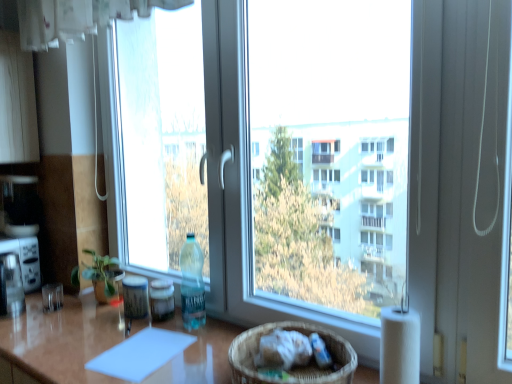
At what (x,y) coordinates should I click in order to perform the action: click on shiny brown table at center. Please return your answer as a coordinate pair (x, y). The image size is (512, 384). Looking at the image, I should click on (58, 341).

What is the approximate height of white paper at right?

It is 24.24 centimeters.

Image resolution: width=512 pixels, height=384 pixels. Describe the element at coordinates (399, 346) in the screenshot. I see `white paper at right` at that location.

What are the coordinates of `white plastic toaster at left` in the screenshot? It's located at (25, 259).

Locate an element on the screen. translucent plastic bottle at center is located at coordinates (162, 299).

Measure the distance between green matte plant at left and camera.

The depth of green matte plant at left is 5.52 feet.

Where is `transparent glass window at center`? Image resolution: width=512 pixels, height=384 pixels. transparent glass window at center is located at coordinates (289, 143).

Is shiny brown table at center positioned before green matte plant at left?

Yes, it is.

The height and width of the screenshot is (384, 512). What are the coordinates of `table below the green matte plant at left (from the image's perspective)` in the screenshot? It's located at (58, 341).

From the image's perspective, which object appears higher, shiny brown table at center or green matte plant at left?

green matte plant at left.

Can you confirm if shiny brown table at center is smaller than green matte plant at left?

No, shiny brown table at center is not smaller than green matte plant at left.

The image size is (512, 384). I want to click on basket located underneath the white plastic toaster at left (from a real-world perspective), so click(x=294, y=366).

Is woven brown basket at lower center not close to white plastic toaster at left?

Yes, woven brown basket at lower center and white plastic toaster at left are located far from each other.

Is woven brown basket at lower center aimed at white plastic toaster at left?

No, woven brown basket at lower center is not aimed at white plastic toaster at left.

Looking at this image, which point is more forward, (x=275, y=325) or (x=26, y=248)?

The point (x=275, y=325) is closer to the camera.

Are green matte plant at left and transparent glass window at center located far from each other?

Yes, green matte plant at left and transparent glass window at center are quite far apart.

Between green matte plant at left and transparent glass window at center, which one has smaller size?

With smaller size is green matte plant at left.

Based on their positions, is green matte plant at left located to the left or right of transparent glass window at center?

Based on their positions, green matte plant at left is located to the left of transparent glass window at center.

Does point (112, 282) lie in front of point (357, 298)?

No, it is not.

Considering the relative sizes of woven brown basket at lower center and translucent plastic bottle at center in the image provided, is woven brown basket at lower center wider than translucent plastic bottle at center?

Indeed, woven brown basket at lower center has a greater width compared to translucent plastic bottle at center.

Is woven brown basket at lower center taller than translucent plastic bottle at center?

In fact, woven brown basket at lower center may be shorter than translucent plastic bottle at center.

In the image, is woven brown basket at lower center positioned in front of or behind translucent plastic bottle at center?

Clearly, woven brown basket at lower center is in front of translucent plastic bottle at center.

Is transparent glass window at center far from woven brown basket at lower center?

transparent glass window at center is positioned a significant distance from woven brown basket at lower center.

Is transparent glass window at center to the right of woven brown basket at lower center from the viewer's perspective?

No, transparent glass window at center is not to the right of woven brown basket at lower center.

How far apart are transparent glass window at center and woven brown basket at lower center?

A distance of 8.82 feet exists between transparent glass window at center and woven brown basket at lower center.

Is transparent glass window at center wider than woven brown basket at lower center?

In fact, transparent glass window at center might be narrower than woven brown basket at lower center.

Considering the positions of points (163, 380) and (318, 377), is point (163, 380) closer to camera compared to point (318, 377)?

No, it is not.

Is the position of shiny brown table at center less distant than that of woven brown basket at lower center?

Yes, the depth of shiny brown table at center is less than that of woven brown basket at lower center.

Could you tell me if shiny brown table at center is facing woven brown basket at lower center?

No.

Looking at this image, does shiny brown table at center have a greater width compared to woven brown basket at lower center?

Correct, the width of shiny brown table at center exceeds that of woven brown basket at lower center.

Which object is closer to the camera taking this photo, white paper at right or white plastic toaster at left?

white paper at right is more forward.

Is white paper at right positioned with its back to white plastic toaster at left?

No, white plastic toaster at left is not at the back of white paper at right.

Would you consider white paper at right to be distant from white plastic toaster at left?

white paper at right is positioned a significant distance from white plastic toaster at left.

From the image's perspective, relative to white plastic toaster at left, is white paper at right above or below?

white paper at right is below white plastic toaster at left.

Locate an element on the screen. table lying on the right of green matte plant at left is located at coordinates (58, 341).

Image resolution: width=512 pixels, height=384 pixels. I want to click on basket below the white plastic toaster at left (from the image's perspective), so click(294, 366).

When comparing their distances from translucent plastic bottle at center, does green matte plant at left or woven brown basket at lower center seem closer?

Based on the image, green matte plant at left appears to be nearer to translucent plastic bottle at center.

Looking at the image, which one is located closer to white paper at right, green matte plant at left or transparent glass window at center?

Based on the image, green matte plant at left appears to be nearer to white paper at right.

Based on their spatial positions, is green matte plant at left or woven brown basket at lower center further from shiny brown table at center?

woven brown basket at lower center is further to shiny brown table at center.

From the image, which object appears to be nearer to green matte plant at left, woven brown basket at lower center or white plastic toaster at left?

white plastic toaster at left is closer to green matte plant at left.

From the image, which object appears to be farther from translucent plastic bottle at center, woven brown basket at lower center or green matte plant at left?

woven brown basket at lower center is positioned further to the anchor translucent plastic bottle at center.

When comparing their distances from white plastic toaster at left, does shiny brown table at center or green matte plant at left seem closer?

Among the two, green matte plant at left is located nearer to white plastic toaster at left.

Estimate the real-world distances between objects in this image. Which object is closer to green matte plant at left, white plastic toaster at left or white paper at right?

white plastic toaster at left is closer to green matte plant at left.

When comparing their distances from green matte plant at left, does woven brown basket at lower center or shiny brown table at center seem further?

woven brown basket at lower center lies further to green matte plant at left than the other object.

Image resolution: width=512 pixels, height=384 pixels. Find the location of `basket between green matte plant at left and white paper at right in the horizontal direction`. basket between green matte plant at left and white paper at right in the horizontal direction is located at coordinates (294, 366).

I want to click on toilet paper between transparent glass window at center and woven brown basket at lower center from top to bottom, so click(x=399, y=346).

This screenshot has height=384, width=512. Identify the location of houseplant located between shiny brown table at center and white plastic toaster at left in the depth direction. (102, 277).

I want to click on window between white plastic toaster at left and white paper at right from left to right, so click(x=289, y=143).